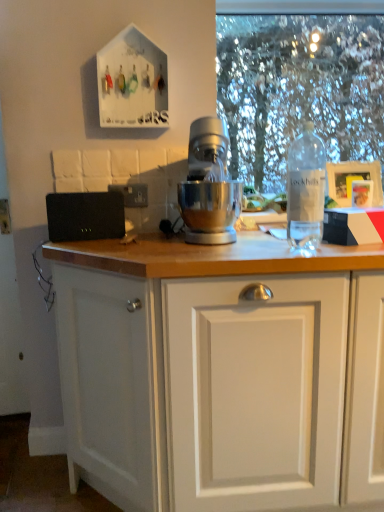
Describe the element at coordinates (132, 194) in the screenshot. I see `black plastic electric outlet at upper left` at that location.

The height and width of the screenshot is (512, 384). What are the coordinates of `clear plastic bottle at right` in the screenshot? It's located at (299, 89).

This screenshot has height=512, width=384. What do you see at coordinates (306, 188) in the screenshot?
I see `clear plastic bottle at right` at bounding box center [306, 188].

In order to click on silver metallic mixer at center in this screenshot , I will do `click(209, 186)`.

Locate an element on the screen. This screenshot has width=384, height=512. black plastic electric outlet at upper left is located at coordinates (132, 194).

Which is closer to the camera, (355, 128) or (238, 216)?

Point (355, 128).

From a real-world perspective, between clear plastic bottle at right and silver metallic mixer at center, who is vertically lower?

silver metallic mixer at center.

Is clear plastic bottle at right inside the boundaries of silver metallic mixer at center, or outside?

clear plastic bottle at right lies outside silver metallic mixer at center.

How far apart are clear plastic bottle at right and silver metallic mixer at center?

The distance of clear plastic bottle at right from silver metallic mixer at center is 2.42 meters.

This screenshot has height=512, width=384. What are the coordinates of `bottle lying below the silver metallic mixer at center (from the image's perspective)` in the screenshot? It's located at (306, 188).

Considering the relative positions of silver metallic mixer at center and clear plastic bottle at right in the image provided, is silver metallic mixer at center to the left or to the right of clear plastic bottle at right?

In the image, silver metallic mixer at center appears on the left side of clear plastic bottle at right.

Is silver metallic mixer at center positioned behind clear plastic bottle at right?

Yes, silver metallic mixer at center is further from the camera.

Is point (214, 237) behind point (292, 157)?

Yes.

Which is closer, (x=145, y=190) or (x=287, y=237)?

Clearly, point (x=145, y=190) is more distant from the camera than point (x=287, y=237).

Does black plastic electric outlet at upper left lie in front of clear plastic bottle at right?

No, it is not.

Considering the relative positions of black plastic electric outlet at upper left and clear plastic bottle at right in the image provided, is black plastic electric outlet at upper left to the left or to the right of clear plastic bottle at right?

From the image, it's evident that black plastic electric outlet at upper left is to the left of clear plastic bottle at right.

From the image's perspective, does black plastic electric outlet at upper left appear lower than clear plastic bottle at right?

Actually, black plastic electric outlet at upper left appears above clear plastic bottle at right in the image.

Measure the distance from clear plastic bottle at right to clear plastic bottle at right.

clear plastic bottle at right and clear plastic bottle at right are 8.68 feet apart from each other.

Does clear plastic bottle at right appear on the left side of clear plastic bottle at right?

In fact, clear plastic bottle at right is to the right of clear plastic bottle at right.

Does clear plastic bottle at right contain clear plastic bottle at right?

No, clear plastic bottle at right is not inside clear plastic bottle at right.

Between clear plastic bottle at right and clear plastic bottle at right, which one has smaller size?

With smaller size is clear plastic bottle at right.

From a real-world perspective, is clear plastic bottle at right beneath clear plastic bottle at right?

Yes, from a real-world perspective, clear plastic bottle at right is beneath clear plastic bottle at right.

Considering the sizes of clear plastic bottle at right and clear plastic bottle at right in the image, is clear plastic bottle at right bigger or smaller than clear plastic bottle at right?

In the image, clear plastic bottle at right appears to be smaller than clear plastic bottle at right.

Can you tell me how much clear plastic bottle at right and clear plastic bottle at right differ in facing direction?

The angular difference between clear plastic bottle at right and clear plastic bottle at right is 0.469 degrees.

Based on the photo, in terms of width, does clear plastic bottle at right look wider or thinner when compared to silver metallic mixer at center?

Considering their sizes, clear plastic bottle at right looks slimmer than silver metallic mixer at center.

From the image's perspective, is clear plastic bottle at right under silver metallic mixer at center?

Yes.

Is clear plastic bottle at right in front of or behind silver metallic mixer at center in the image?

clear plastic bottle at right is positioned closer to the viewer than silver metallic mixer at center.

Is clear plastic bottle at right aimed at silver metallic mixer at center?

No, clear plastic bottle at right does not turn towards silver metallic mixer at center.

Image resolution: width=384 pixels, height=512 pixels. I want to click on electric outlet that is below the silver metallic mixer at center (from the image's perspective), so (x=132, y=194).

Is black plastic electric outlet at upper left positioned far away from silver metallic mixer at center?

black plastic electric outlet at upper left is actually quite close to silver metallic mixer at center.

From the image's perspective, is black plastic electric outlet at upper left below silver metallic mixer at center?

Correct, black plastic electric outlet at upper left appears lower than silver metallic mixer at center in the image.

Is point (132, 191) more distant than point (219, 170)?

Yes, point (132, 191) is behind point (219, 170).

Identify the location of clear on the right of silver metallic mixer at center. The image size is (384, 512). (299, 89).

Image resolution: width=384 pixels, height=512 pixels. I want to click on bottle located below the silver metallic mixer at center (from the image's perspective), so click(x=306, y=188).

From the image, which object appears to be farther from silver metallic mixer at center, clear plastic bottle at right or black plastic electric outlet at upper left?

clear plastic bottle at right is positioned further to the anchor silver metallic mixer at center.

Which object lies further to the anchor point clear plastic bottle at right, clear plastic bottle at right or silver metallic mixer at center?

clear plastic bottle at right is positioned further to the anchor clear plastic bottle at right.

From the image, which object appears to be nearer to silver metallic mixer at center, clear plastic bottle at right or clear plastic bottle at right?

The object closer to silver metallic mixer at center is clear plastic bottle at right.

Looking at the image, which one is located closer to clear plastic bottle at right, clear plastic bottle at right or black plastic electric outlet at upper left?

The object closer to clear plastic bottle at right is black plastic electric outlet at upper left.

Estimate the real-world distances between objects in this image. Which object is closer to clear plastic bottle at right, black plastic electric outlet at upper left or silver metallic mixer at center?

Based on the image, silver metallic mixer at center appears to be nearer to clear plastic bottle at right.

When comparing their distances from black plastic electric outlet at upper left, does clear plastic bottle at right or clear plastic bottle at right seem further?

Based on the image, clear plastic bottle at right appears to be further to black plastic electric outlet at upper left.

Estimate the real-world distances between objects in this image. Which object is further from clear plastic bottle at right, black plastic electric outlet at upper left or clear plastic bottle at right?

clear plastic bottle at right is positioned further to the anchor clear plastic bottle at right.

From the image, which object appears to be farther from clear plastic bottle at right, black plastic electric outlet at upper left or clear plastic bottle at right?

black plastic electric outlet at upper left.

The image size is (384, 512). I want to click on bottle between black plastic electric outlet at upper left and clear plastic bottle at right in the horizontal direction, so click(x=306, y=188).

Where is `mixer located between black plastic electric outlet at upper left and clear plastic bottle at right in the left-right direction`? Image resolution: width=384 pixels, height=512 pixels. mixer located between black plastic electric outlet at upper left and clear plastic bottle at right in the left-right direction is located at coordinates (209, 186).

Locate an element on the screen. Image resolution: width=384 pixels, height=512 pixels. mixer situated between black plastic electric outlet at upper left and clear plastic bottle at right from left to right is located at coordinates (209, 186).

Identify the location of mixer between clear plastic bottle at right and clear plastic bottle at right from front to back. The image size is (384, 512). (209, 186).